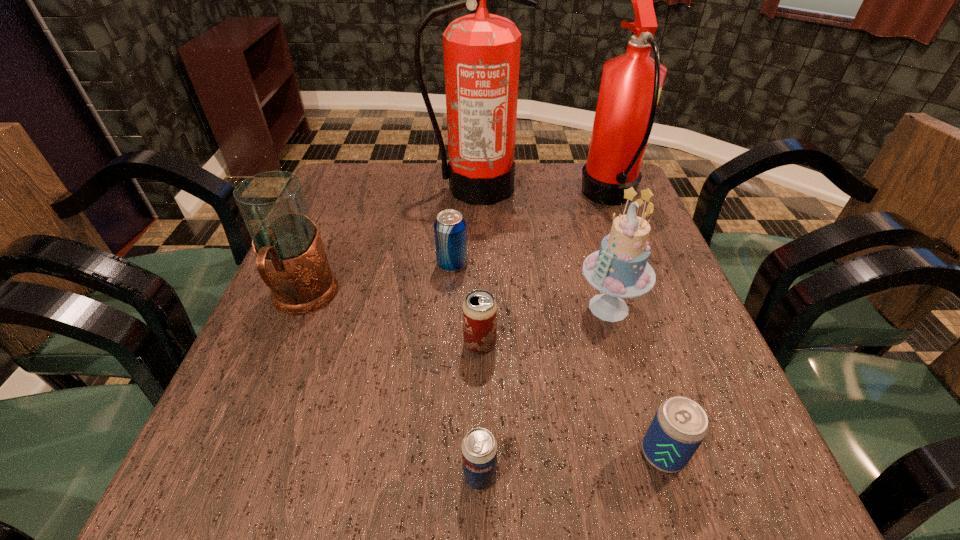
I want to click on the left fire extinguisher, so click(481, 51).

You are a GUI agent. You are given a task and a screenshot of the screen. Output one action in this format:
    pyautogui.click(x=<x>, y=<y>)
    Task: Click on the right fire extinguisher
    
    Given the screenshot: What is the action you would take?
    pyautogui.click(x=631, y=84)

Where is `cake`? Image resolution: width=960 pixels, height=540 pixels. cake is located at coordinates (619, 269).

Identify the location of pitcher. (291, 260).

Find the location of a particular element. the farthest beer can is located at coordinates (450, 232).

The image size is (960, 540). Find the location of `the second farthest beer can`. the second farthest beer can is located at coordinates (479, 310).

Where is `the rightmost beer can`? Image resolution: width=960 pixels, height=540 pixels. the rightmost beer can is located at coordinates (679, 426).

Where is `vacant space located on the front side of the left fire extinguisher`? vacant space located on the front side of the left fire extinguisher is located at coordinates (473, 307).

Find the location of `vacant space located 0.070m at the spray nozzle of the right fire extinguisher`. vacant space located 0.070m at the spray nozzle of the right fire extinguisher is located at coordinates (555, 198).

Locate an element on the screen. Image resolution: width=960 pixels, height=540 pixels. free region located 0.150m at the spray nozzle of the right fire extinguisher is located at coordinates (526, 198).